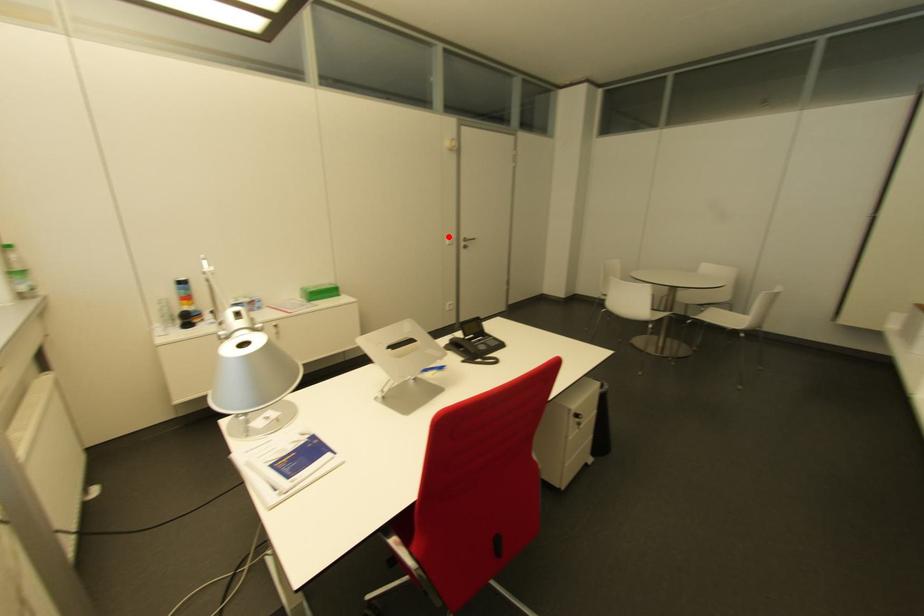
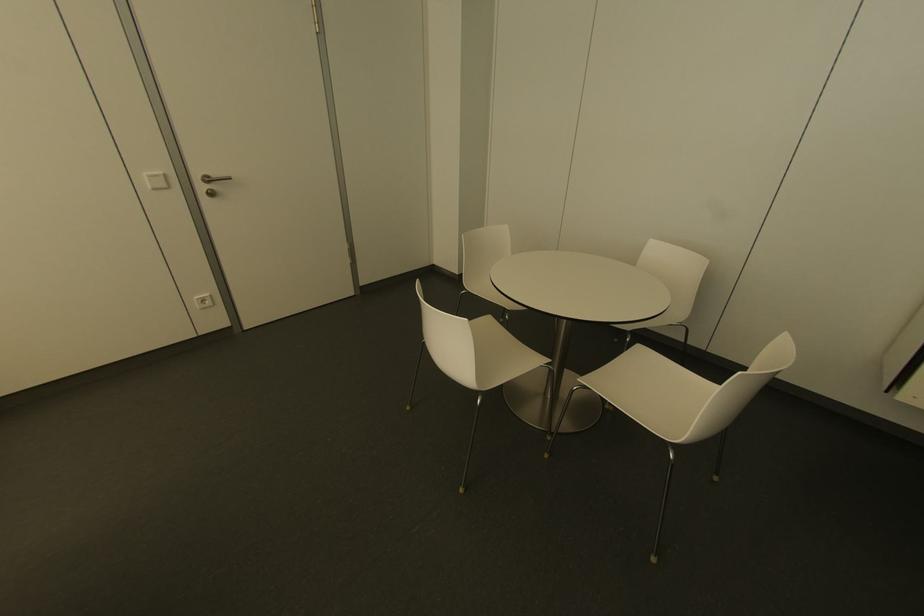
Find the pixel in the second image that matches the highlighted location in the first image.

(159, 172)